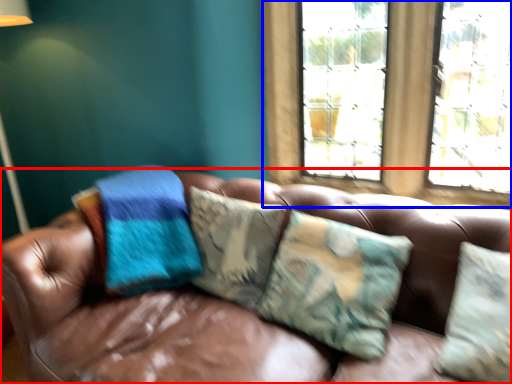
Question: Which object appears farthest to the camera in this image, studio couch (highlighted by a red box) or window (highlighted by a blue box)?

Choices:
 (A) studio couch
 (B) window

Answer: (B)